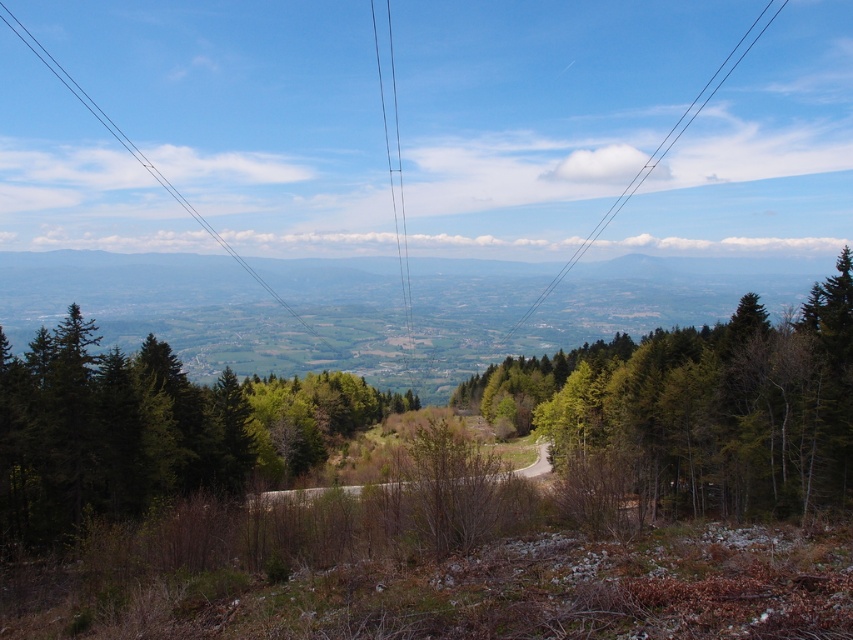
Who is lower down, clear wire at upper center or black wire at center?

black wire at center

Is clear wire at upper center taller than black wire at center?

Incorrect, clear wire at upper center's height is not larger of black wire at center's.

Who is more distant from viewer, (x=579, y=252) or (x=410, y=323)?

Point (x=579, y=252)

I want to click on clear wire at upper center, so click(662, 147).

Which of these two, black wire at center or black wire at upper center, stands shorter?

With less height is black wire at upper center.

Locate an element on the screen. This screenshot has height=640, width=853. black wire at center is located at coordinates (396, 189).

Is point (550, 385) more distant than point (724, 77)?

That is False.

Find the location of `green leafy tree at center`. green leafy tree at center is located at coordinates (701, 406).